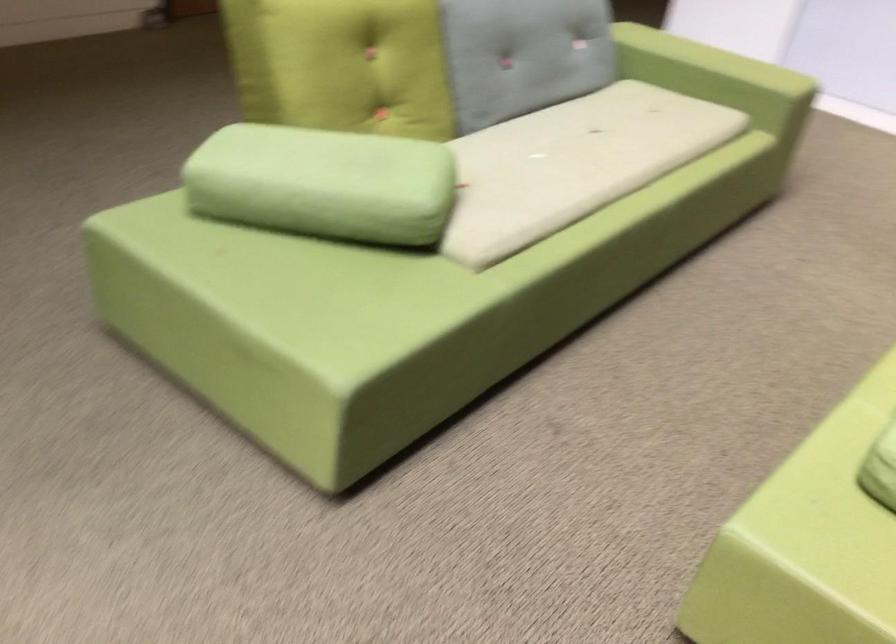
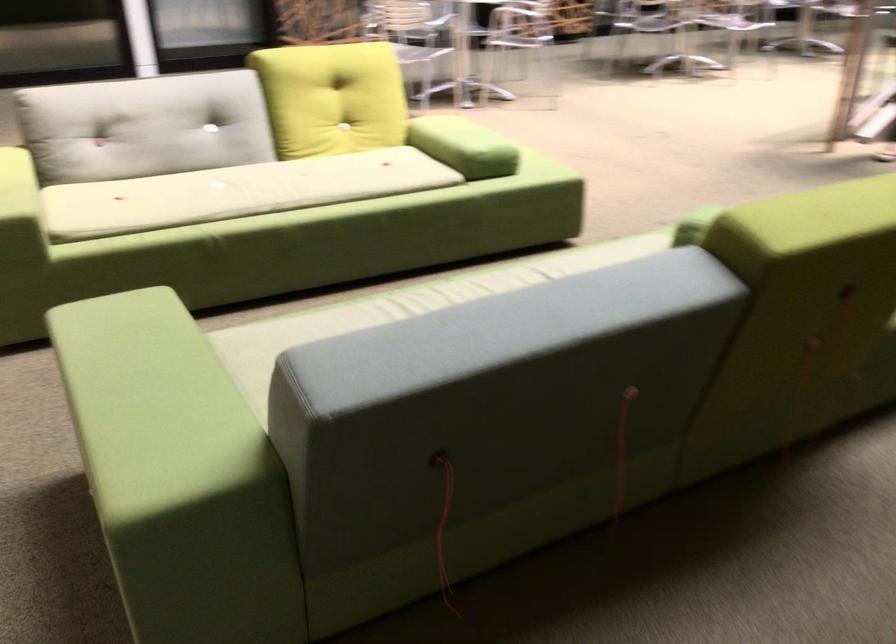
Where in the second image is the point corresponding to point (647, 133) from the first image?

(401, 308)